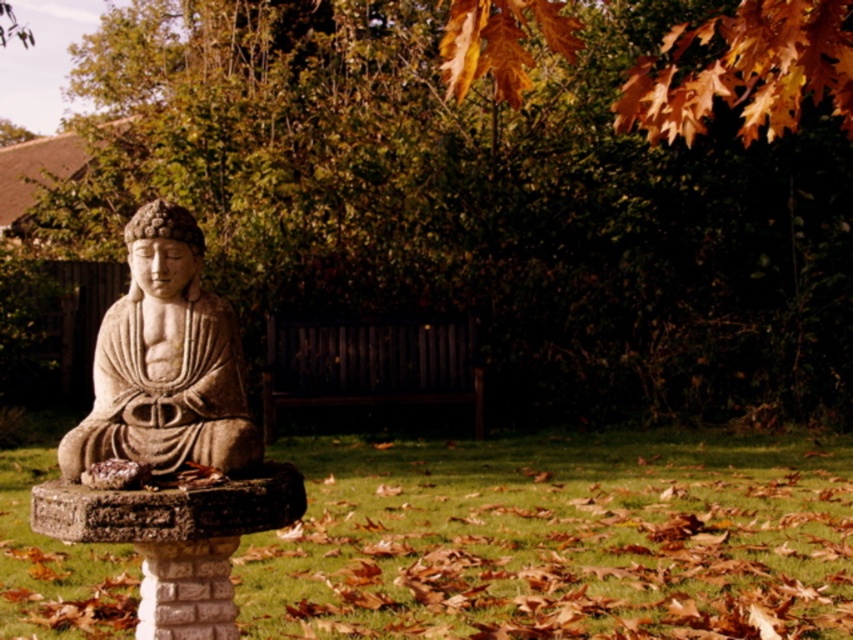
Question: Which object is closer to the camera taking this photo?

Choices:
 (A) dark wood bench at center
 (B) autumn leaves at upper center
 (C) stone statue at center

Answer: (C)

Question: Does autumn leaves at upper center lie behind stone statue at center?

Choices:
 (A) no
 (B) yes

Answer: (B)

Question: Does autumn leaves at upper center lie behind dark wood bench at center?

Choices:
 (A) no
 (B) yes

Answer: (B)

Question: Which point is closer to the camera?

Choices:
 (A) autumn leaves at upper center
 (B) dark wood bench at center

Answer: (B)

Question: Which point is farther to the camera?

Choices:
 (A) (265, 424)
 (B) (204, 465)

Answer: (A)

Question: Does autumn leaves at upper center have a lesser width compared to stone statue at center?

Choices:
 (A) yes
 (B) no

Answer: (B)